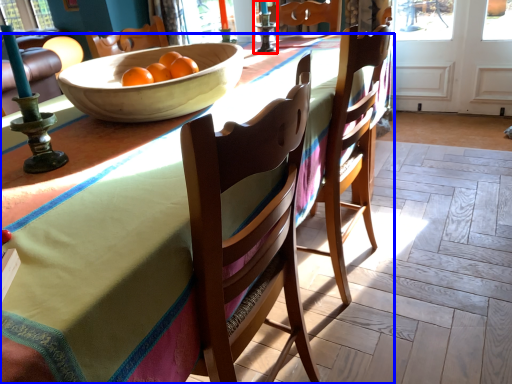
Question: Which point is further to the camera, candle holder (highlighted by a red box) or desk (highlighted by a blue box)?

Choices:
 (A) candle holder
 (B) desk

Answer: (A)